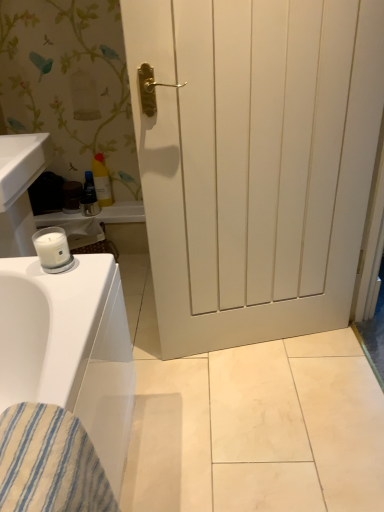
Question: From the image's perspective, is yellow plastic bottle at upper left, the first toiletry from the right, over blue glossy tube at center, which is the first toiletry in left-to-right order?

Choices:
 (A) yes
 (B) no

Answer: (A)

Question: From a real-world perspective, is yellow plastic bottle at upper left, the second toiletry in the left-to-right sequence, positioned over blue glossy tube at center, which is the first toiletry in left-to-right order, based on gravity?

Choices:
 (A) no
 (B) yes

Answer: (B)

Question: Is yellow plastic bottle at upper left, the first toiletry from the right, looking in the opposite direction of blue glossy tube at center, which is the first toiletry in left-to-right order?

Choices:
 (A) yes
 (B) no

Answer: (B)

Question: From a real-world perspective, is yellow plastic bottle at upper left, the first toiletry from the right, under blue glossy tube at center, the second toiletry when ordered from right to left?

Choices:
 (A) no
 (B) yes

Answer: (A)

Question: Can you confirm if yellow plastic bottle at upper left, the first toiletry from the right, is wider than blue glossy tube at center, the second toiletry when ordered from right to left?

Choices:
 (A) no
 (B) yes

Answer: (B)

Question: In terms of width, does yellow plastic bottle at upper left, the second toiletry in the left-to-right sequence, look wider or thinner when compared to white matte door at center?

Choices:
 (A) thin
 (B) wide

Answer: (A)

Question: Is yellow plastic bottle at upper left, the first toiletry from the right, spatially inside white matte door at center, or outside of it?

Choices:
 (A) inside
 (B) outside

Answer: (B)

Question: In terms of size, does yellow plastic bottle at upper left, the first toiletry from the right, appear bigger or smaller than white matte door at center?

Choices:
 (A) big
 (B) small

Answer: (B)

Question: Is point (99, 201) closer or farther from the camera than point (334, 233)?

Choices:
 (A) farther
 (B) closer

Answer: (A)

Question: Is blue glossy tube at center, the second toiletry when ordered from right to left, bigger or smaller than yellow plastic bottle at upper left, the second toiletry in the left-to-right sequence?

Choices:
 (A) big
 (B) small

Answer: (B)

Question: Looking at their shapes, would you say blue glossy tube at center, the second toiletry when ordered from right to left, is wider or thinner than yellow plastic bottle at upper left, the second toiletry in the left-to-right sequence?

Choices:
 (A) wide
 (B) thin

Answer: (B)

Question: Considering their positions, is blue glossy tube at center, the second toiletry when ordered from right to left, located in front of or behind yellow plastic bottle at upper left, the second toiletry in the left-to-right sequence?

Choices:
 (A) behind
 (B) front

Answer: (A)

Question: From the image's perspective, is blue glossy tube at center, which is the first toiletry in left-to-right order, positioned above or below yellow plastic bottle at upper left, the second toiletry in the left-to-right sequence?

Choices:
 (A) below
 (B) above

Answer: (A)

Question: From the image's perspective, is white matte door at center positioned above or below blue glossy tube at center, the second toiletry when ordered from right to left?

Choices:
 (A) above
 (B) below

Answer: (B)

Question: Visually, is white matte door at center positioned to the left or to the right of blue glossy tube at center, the second toiletry when ordered from right to left?

Choices:
 (A) left
 (B) right

Answer: (B)